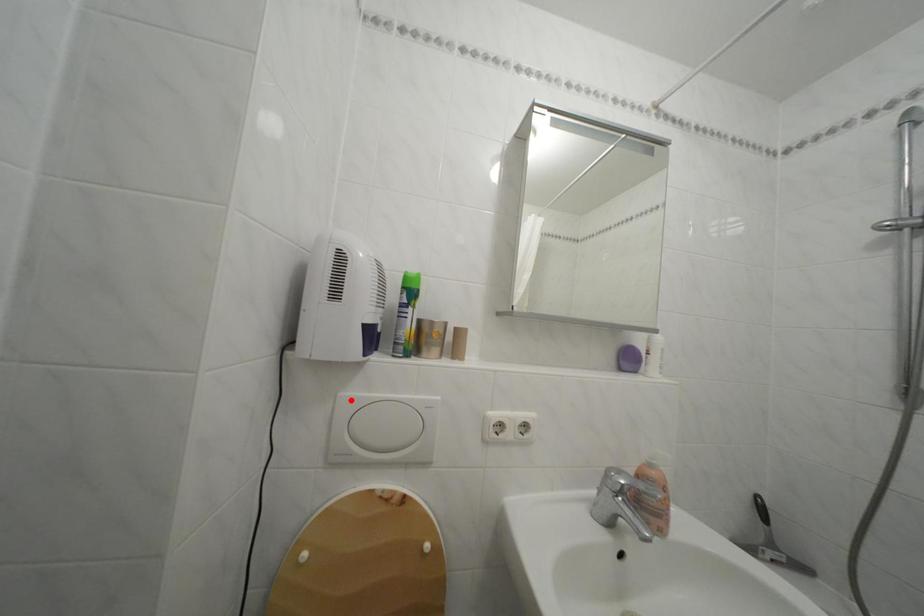
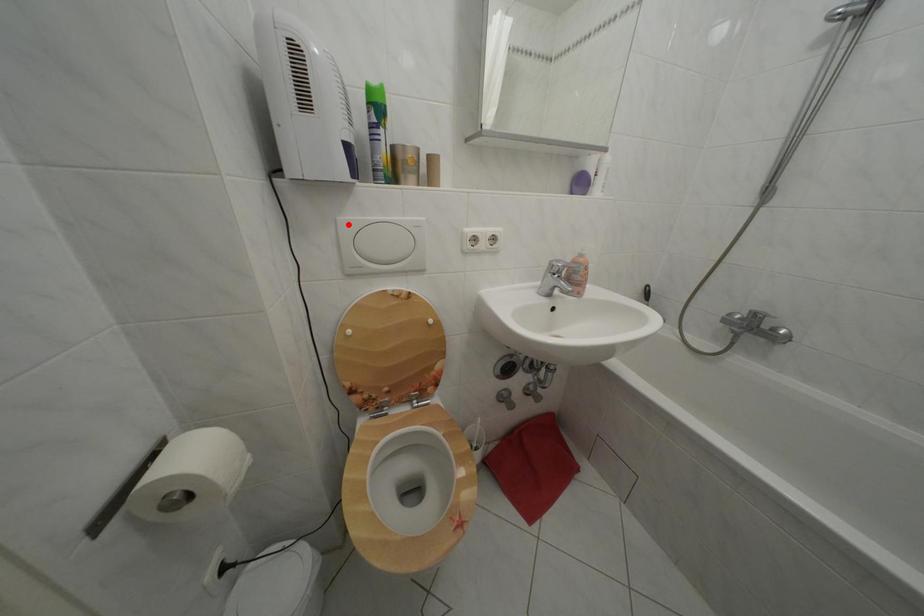
I am providing you with two images of the same scene from different viewpoints. A red point is marked on the first image and another point is marked on the second image. Are the points marked in image1 and image2 representing the same 3D position?

Yes